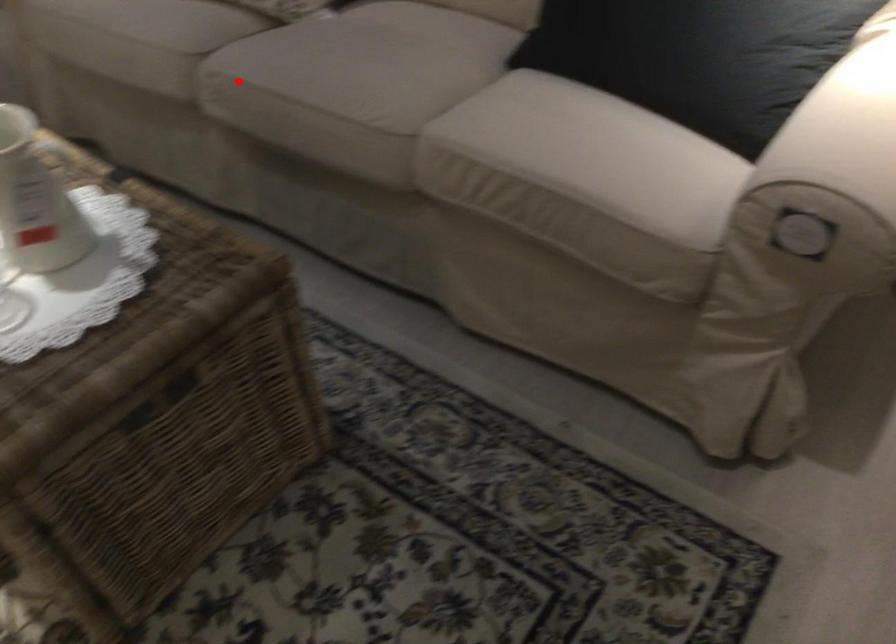
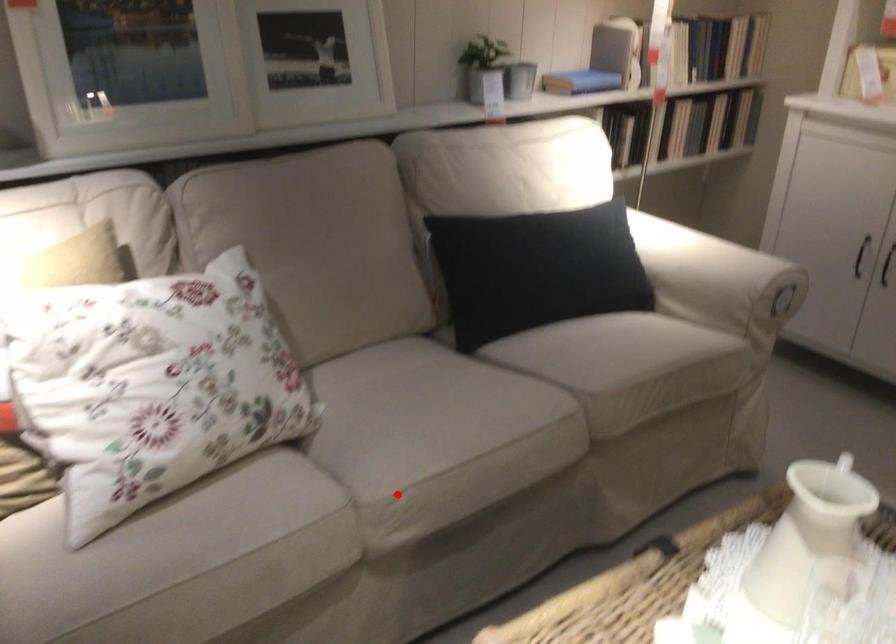
I am providing you with two images of the same scene from different viewpoints. A red point is marked on the first image and another point is marked on the second image. Do the highlighted points in image1 and image2 indicate the same real-world spot?

Yes